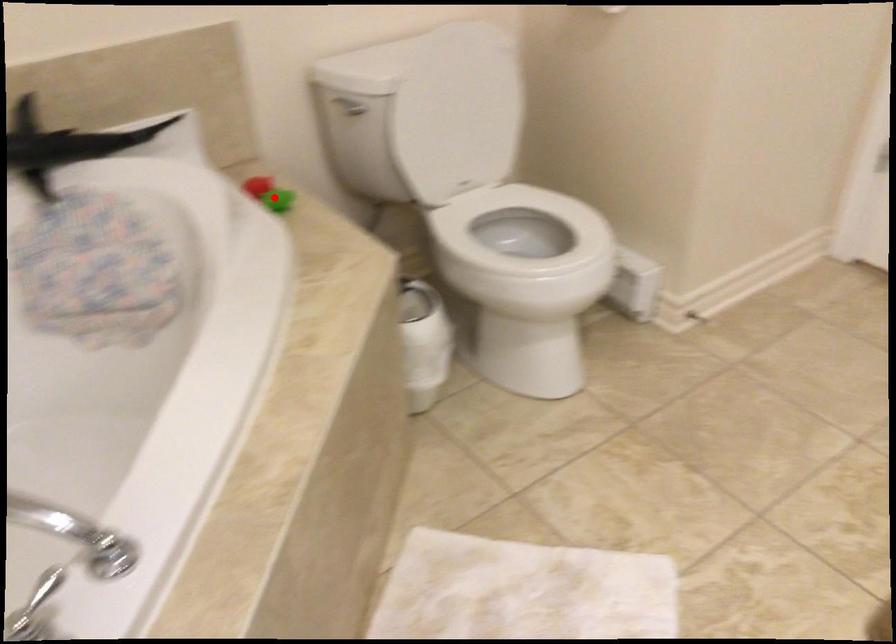
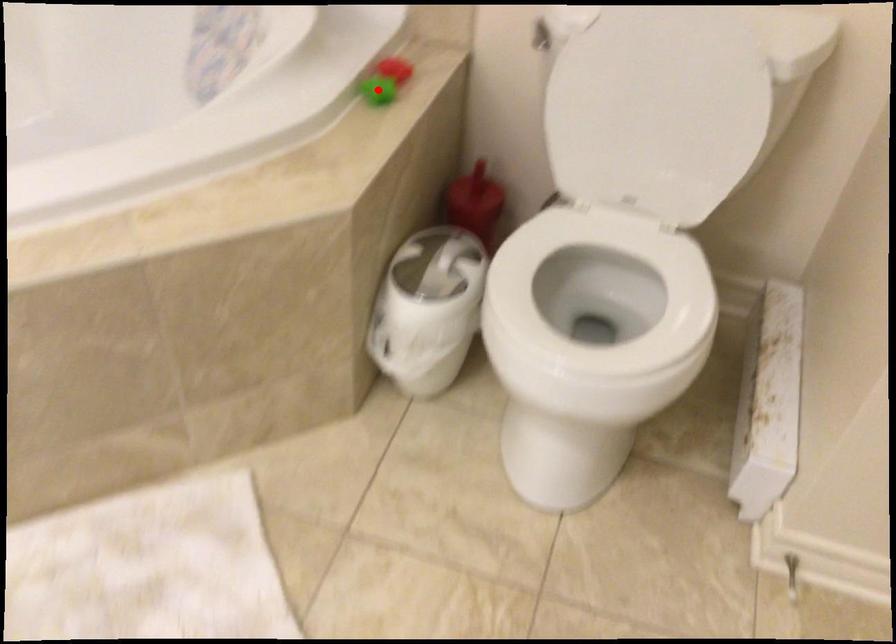
I am providing you with two images of the same scene from different viewpoints. A red point is marked on the first image and another point is marked on the second image. Is the marked point in image1 the same physical position as the marked point in image2?

Yes